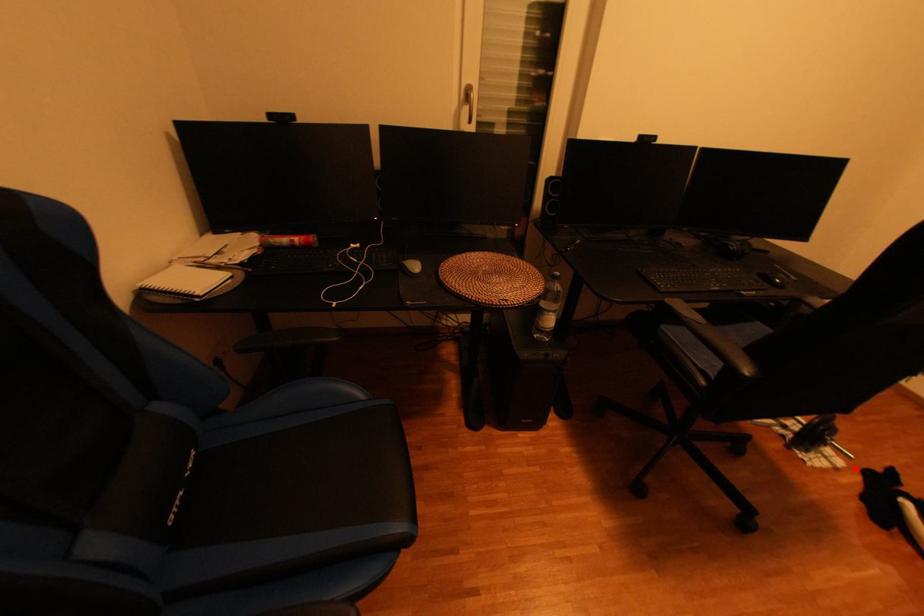
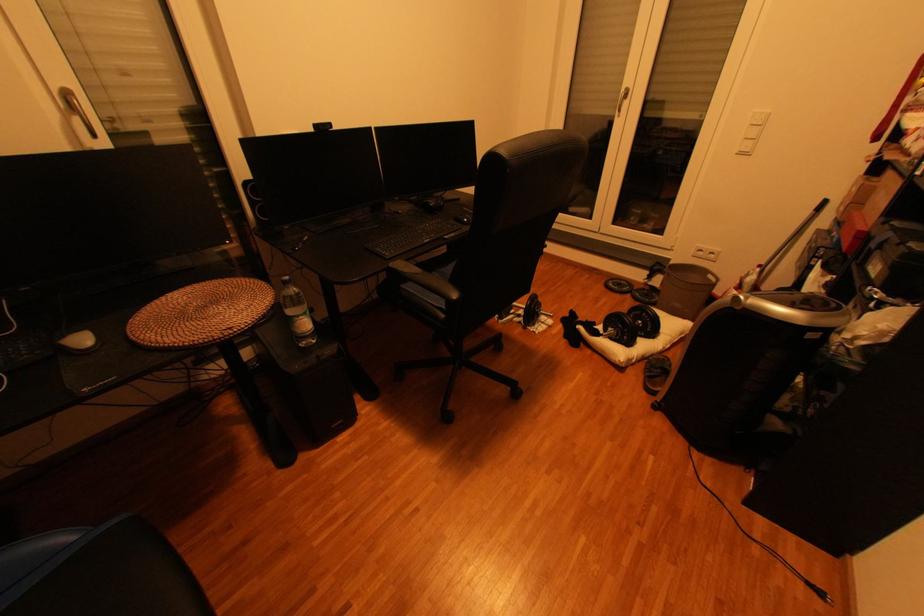
Question: A red point is marked in image1. In image2, is the corresponding 3D point closer to the camera or farther? Reply with the corresponding letter.

Choices:
 (A) The corresponding 3D point is closer.
 (B) The corresponding 3D point is farther.

Answer: (A)